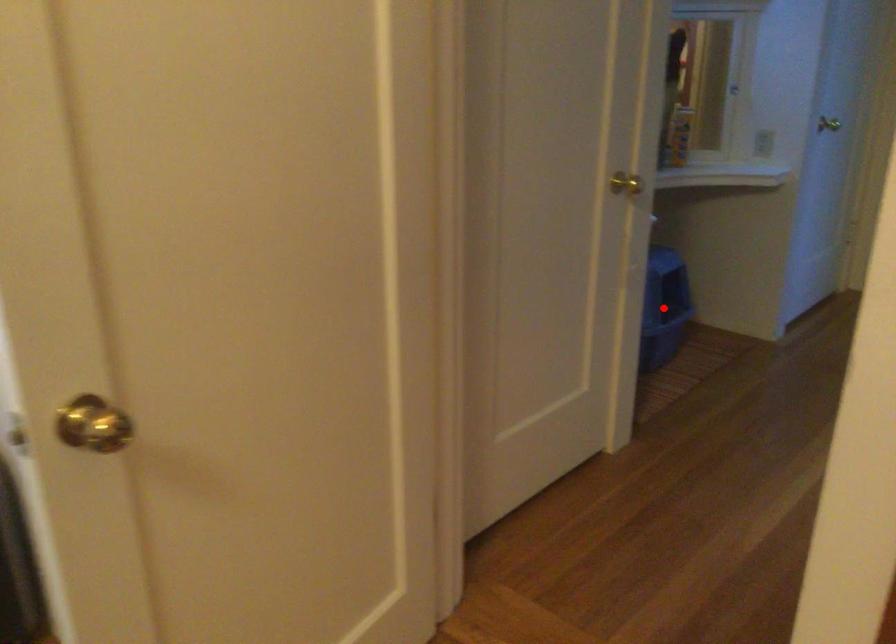
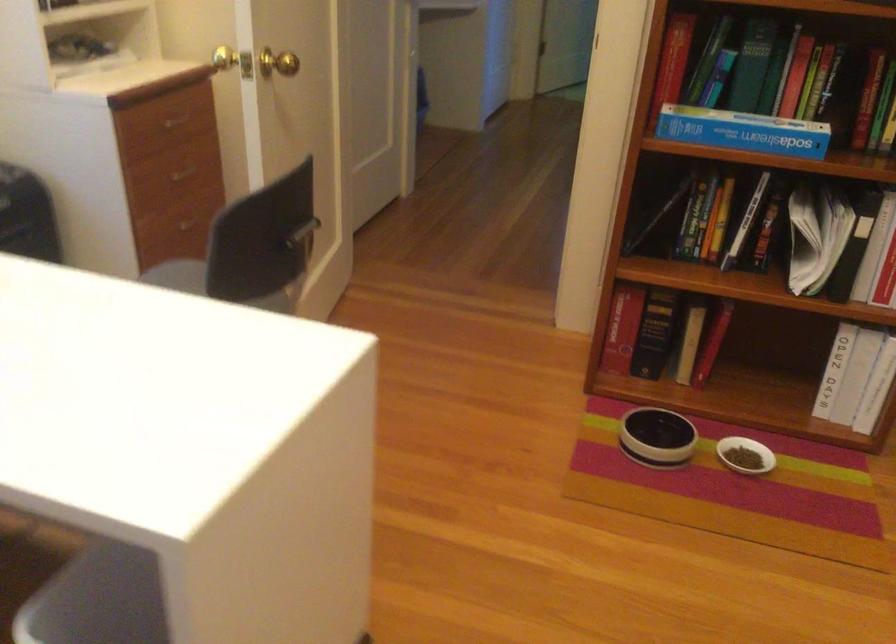
Question: I am providing you with two images of the same scene from different viewpoints. A red point is marked on the first image. Is the red point's position out of view in image 2?

Choices:
 (A) Yes
 (B) No

Answer: (A)